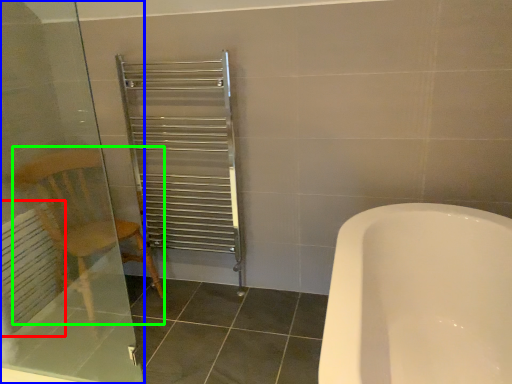
Question: Which object is the farthest from radiator (highlighted by a red box)? Choose among these: screen door (highlighted by a blue box) or armchair (highlighted by a green box).

Choices:
 (A) screen door
 (B) armchair

Answer: (B)